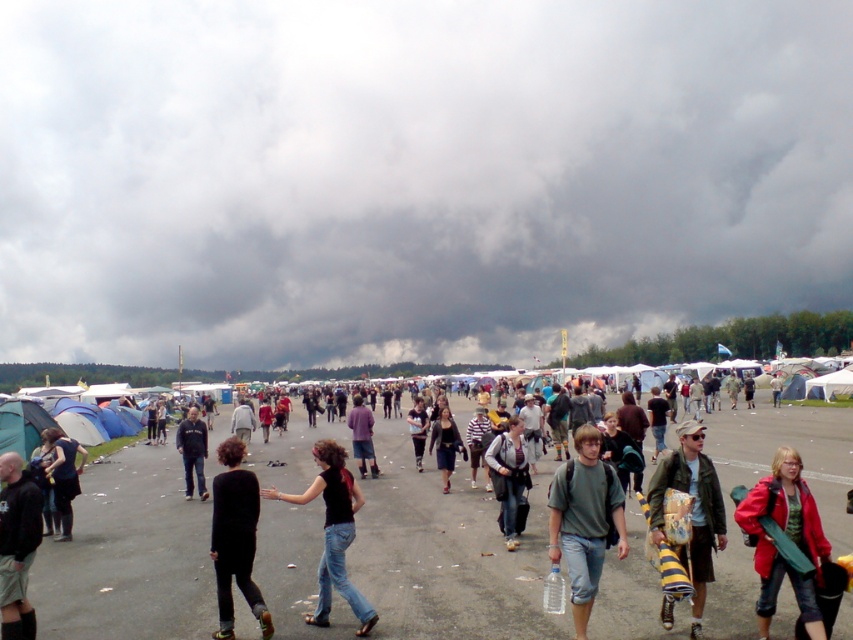
Question: Does dark gray cloud at upper center appear on the right side of black matte jacket at lower left?

Choices:
 (A) yes
 (B) no

Answer: (B)

Question: Is black matte jeans at center above purple cotton shirt at center?

Choices:
 (A) yes
 (B) no

Answer: (A)

Question: Which object is positioned closest to the green fabric jacket at center?

Choices:
 (A) black matte jeans at center
 (B) black fabric jacket at lower left
 (C) dark blue jeans at center

Answer: (A)

Question: Which of these objects is positioned farthest from the black matte dress at center?

Choices:
 (A) gray asphalt at center
 (B) dark gray cloud at upper center
 (C) black matte jeans at center
 (D) denim jacket at center

Answer: (B)

Question: Is green matte t-shirt at center to the left of dark blue jeans at center from the viewer's perspective?

Choices:
 (A) yes
 (B) no

Answer: (B)

Question: Among these points, which one is nearest to the camera?

Choices:
 (A) tap(370, 436)
 (B) tap(503, 520)

Answer: (B)